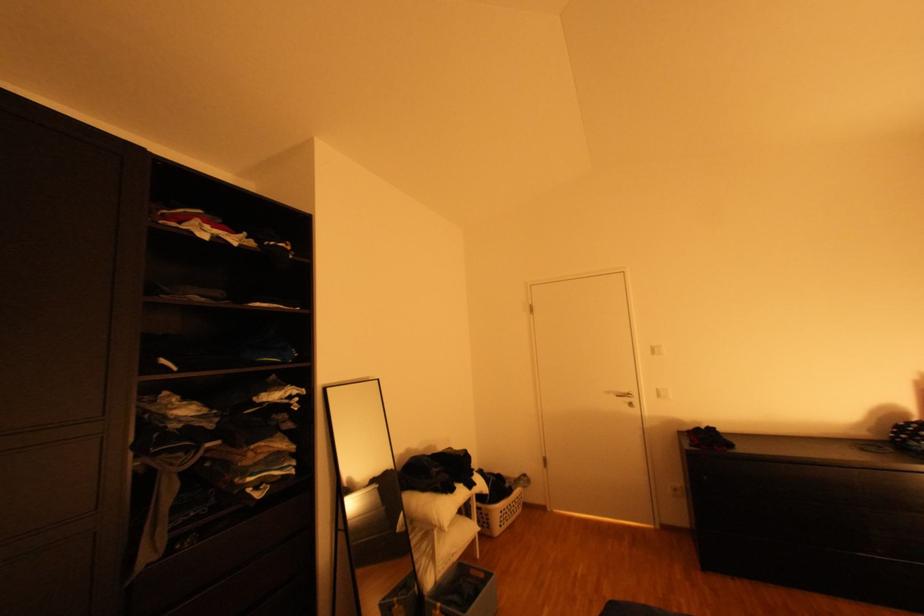
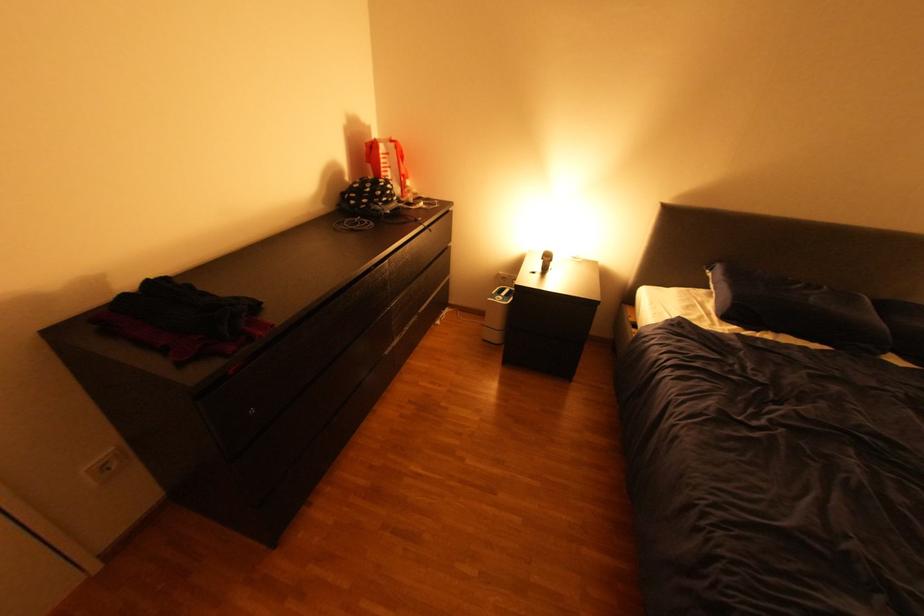
Find the pixel in the second image that matches (685,488) in the first image.

(114, 467)